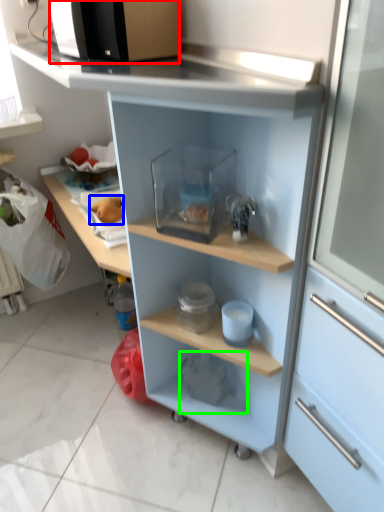
Question: Which object is positioned farthest from microwave oven (highlighted by a red box)? Select from food (highlighted by a blue box) and appliance (highlighted by a green box).

Choices:
 (A) food
 (B) appliance

Answer: (B)